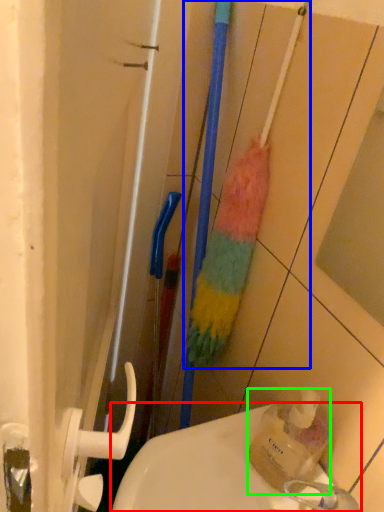
Question: Which object is positioned farthest from sink (highlighted by a red box)? Select from brush (highlighted by a blue box) and bottle (highlighted by a green box).

Choices:
 (A) brush
 (B) bottle

Answer: (A)